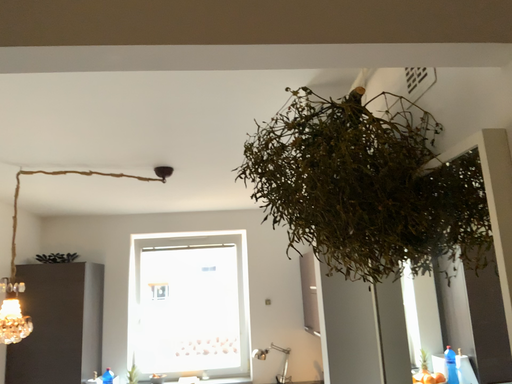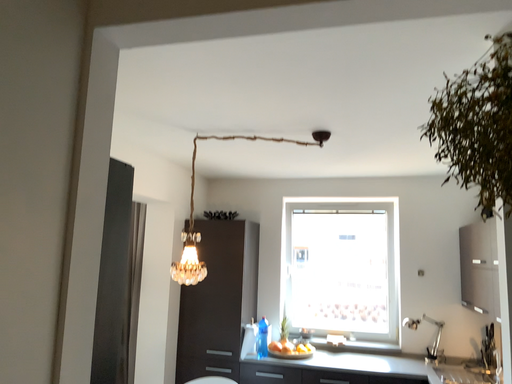
Question: Which way did the camera rotate in the video?

Choices:
 (A) rotated left
 (B) rotated right

Answer: (A)